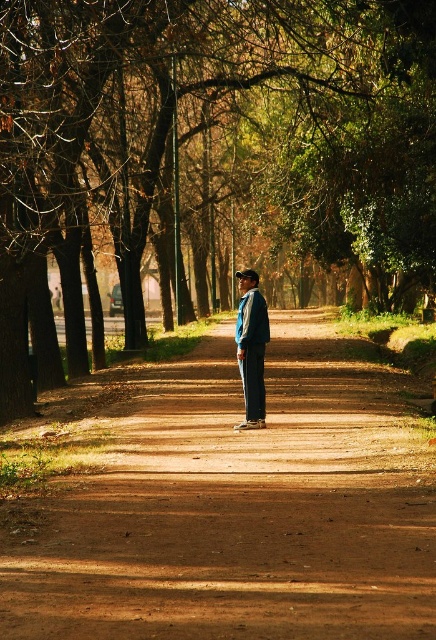
You are standing on the dirt road at center and want to pick up the denim jacket at center. Can you reach it without moving your feet?

The denim jacket at center is above the dirt road at center, so you can reach it without moving your feet.